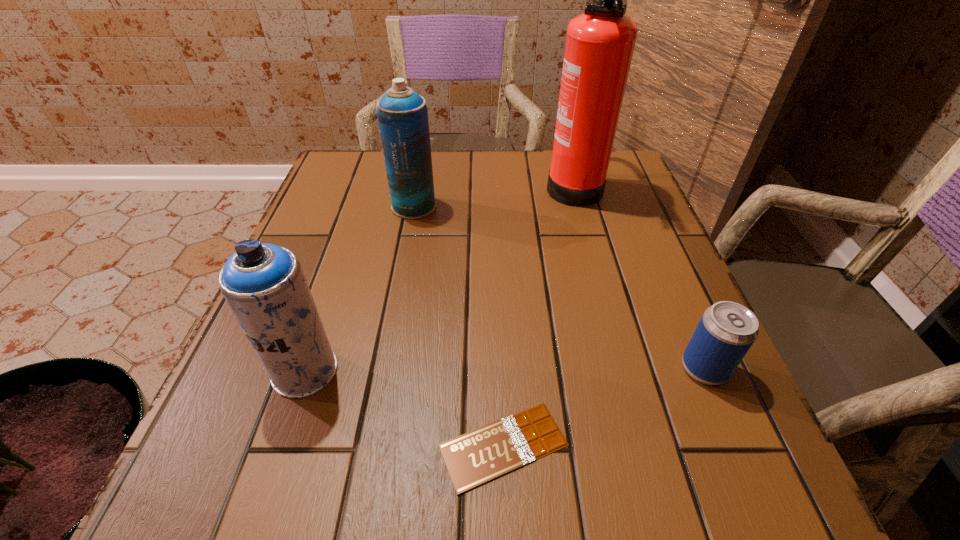
Where is `vacant position located at the nozzle of the fourth object from left to right`? This screenshot has width=960, height=540. vacant position located at the nozzle of the fourth object from left to right is located at coordinates (395, 183).

Where is `free region located at the nozzle of the fourth object from left to right`? The image size is (960, 540). free region located at the nozzle of the fourth object from left to right is located at coordinates pyautogui.click(x=469, y=183).

The width and height of the screenshot is (960, 540). In order to click on vacant space located at the nozzle of the fourth object from left to right in this screenshot , I will do `click(462, 183)`.

At what (x,y) coordinates should I click in order to perform the action: click on free region located on the left of the farther aerosol can. Please return your answer as a coordinate pair (x, y). The image size is (960, 540). Looking at the image, I should click on (324, 206).

Image resolution: width=960 pixels, height=540 pixels. What are the coordinates of `vacant space located 0.180m on the right of the leftmost object` in the screenshot? It's located at (448, 370).

Identify the location of free space located on the back of the rightmost object. This screenshot has height=540, width=960. (681, 314).

This screenshot has height=540, width=960. In order to click on vacant space located 0.160m on the back of the third object from right to left in this screenshot , I will do point(498,322).

Where is `fire extinguisher positioned at the far edge`? Image resolution: width=960 pixels, height=540 pixels. fire extinguisher positioned at the far edge is located at coordinates (600, 42).

Where is `aerosol can at the far edge`? The height and width of the screenshot is (540, 960). aerosol can at the far edge is located at coordinates (402, 114).

Where is `object that is at the near edge`? Image resolution: width=960 pixels, height=540 pixels. object that is at the near edge is located at coordinates tap(472, 459).